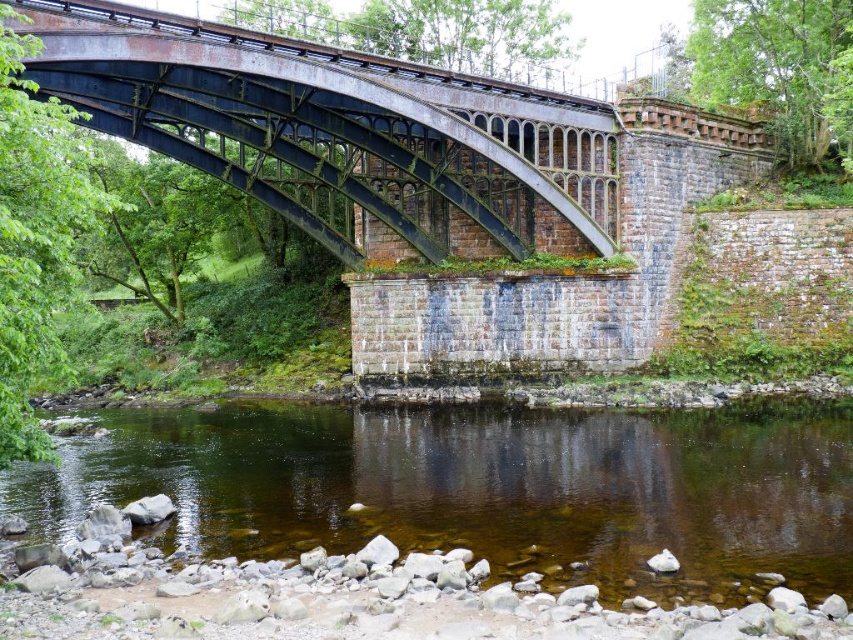
Can you confirm if clear water at center is thinner than rusty metal arch bridge at center?

In fact, clear water at center might be wider than rusty metal arch bridge at center.

Is point (553, 451) positioned after point (76, 33)?

Yes, point (553, 451) is behind point (76, 33).

Measure the distance between clear water at center and camera.

clear water at center is 40.16 meters from camera.

Find the location of `clear water at center`. clear water at center is located at coordinates (486, 488).